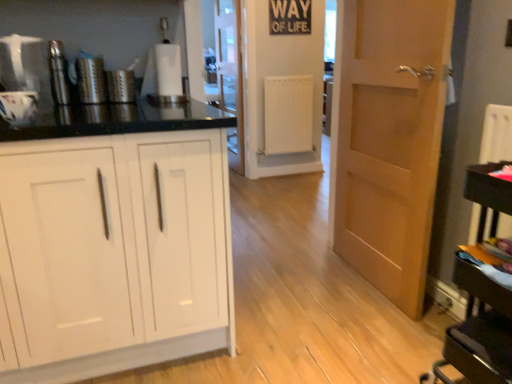
Question: Can we say white matte cabinet at left lies outside brushed metal grater at left, arranged as the third appliance when viewed from the front?

Choices:
 (A) no
 (B) yes

Answer: (B)

Question: Does white matte cabinet at left have a lesser width compared to brushed metal grater at left, the second appliance viewed from the back?

Choices:
 (A) no
 (B) yes

Answer: (A)

Question: Considering the relative positions of white matte cabinet at left and brushed metal grater at left, the second appliance viewed from the back, in the image provided, is white matte cabinet at left to the right of brushed metal grater at left, the second appliance viewed from the back, from the viewer's perspective?

Choices:
 (A) yes
 (B) no

Answer: (A)

Question: Is white matte cabinet at left with brushed metal grater at left, arranged as the third appliance when viewed from the front?

Choices:
 (A) no
 (B) yes

Answer: (A)

Question: Does white matte cabinet at left appear on the left side of brushed metal grater at left, the second appliance viewed from the back?

Choices:
 (A) yes
 (B) no

Answer: (B)

Question: From a real-world perspective, is white matte cabinet at left located higher than brushed metal grater at left, the second appliance viewed from the back?

Choices:
 (A) no
 (B) yes

Answer: (A)

Question: From the image's perspective, is brushed metal grater at left, the second appliance viewed from the back, on top of light brown wood door at right?

Choices:
 (A) no
 (B) yes

Answer: (B)

Question: Does brushed metal grater at left, arranged as the third appliance when viewed from the front, have a greater width compared to light brown wood door at right?

Choices:
 (A) no
 (B) yes

Answer: (A)

Question: Is brushed metal grater at left, arranged as the third appliance when viewed from the front, positioned with its back to light brown wood door at right?

Choices:
 (A) yes
 (B) no

Answer: (B)

Question: From the image's perspective, would you say brushed metal grater at left, arranged as the third appliance when viewed from the front, is shown under light brown wood door at right?

Choices:
 (A) no
 (B) yes

Answer: (A)

Question: Considering the relative positions of brushed metal grater at left, arranged as the third appliance when viewed from the front, and light brown wood door at right in the image provided, is brushed metal grater at left, arranged as the third appliance when viewed from the front, in front of light brown wood door at right?

Choices:
 (A) no
 (B) yes

Answer: (A)

Question: Could you tell me if brushed metal grater at left, the second appliance viewed from the back, is turned towards light brown wood door at right?

Choices:
 (A) no
 (B) yes

Answer: (A)

Question: Is the surface of white matte cabinet at left in direct contact with metallic silver thermos at left, which appears as the second appliance when viewed from the front?

Choices:
 (A) yes
 (B) no

Answer: (B)